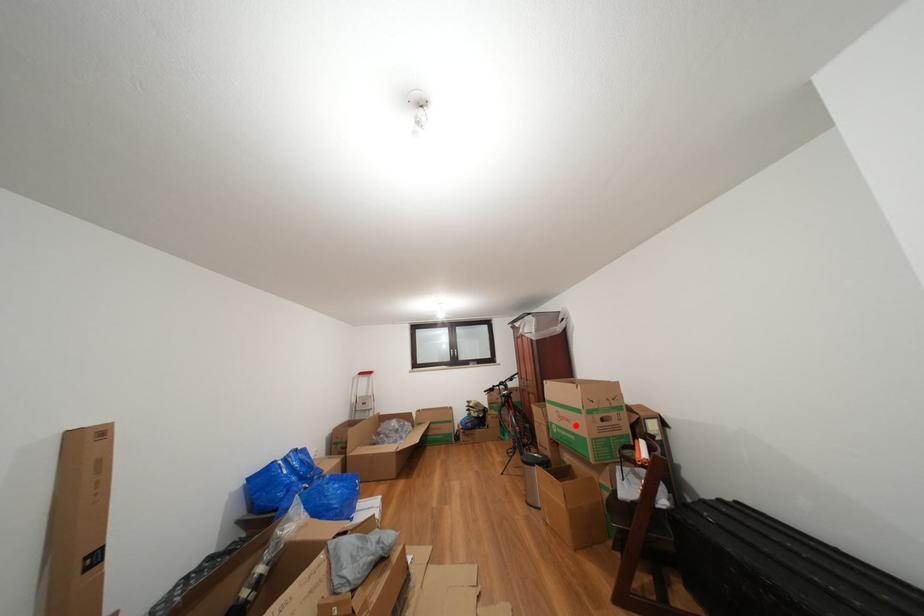
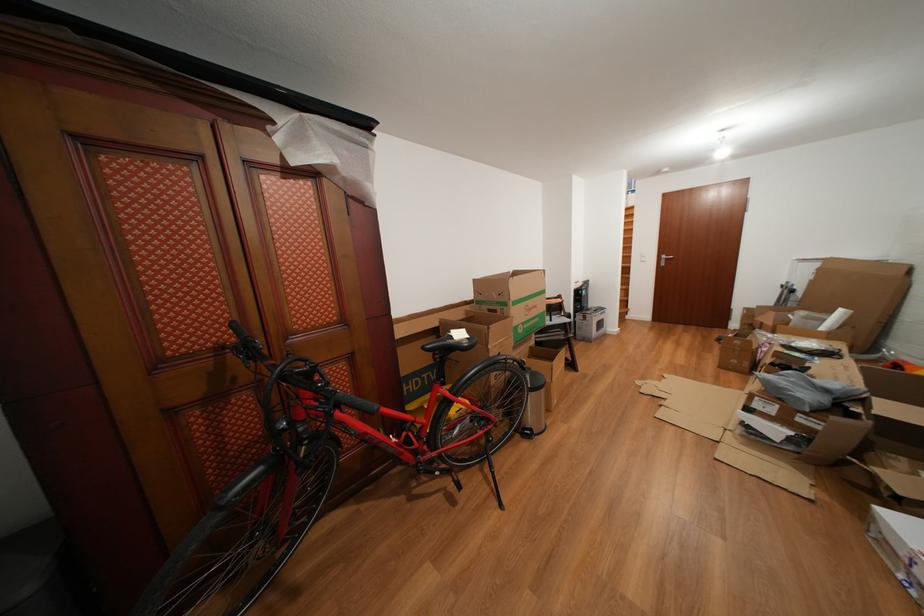
Find the pixel in the second image that matches the highlighted location in the first image.

(543, 312)